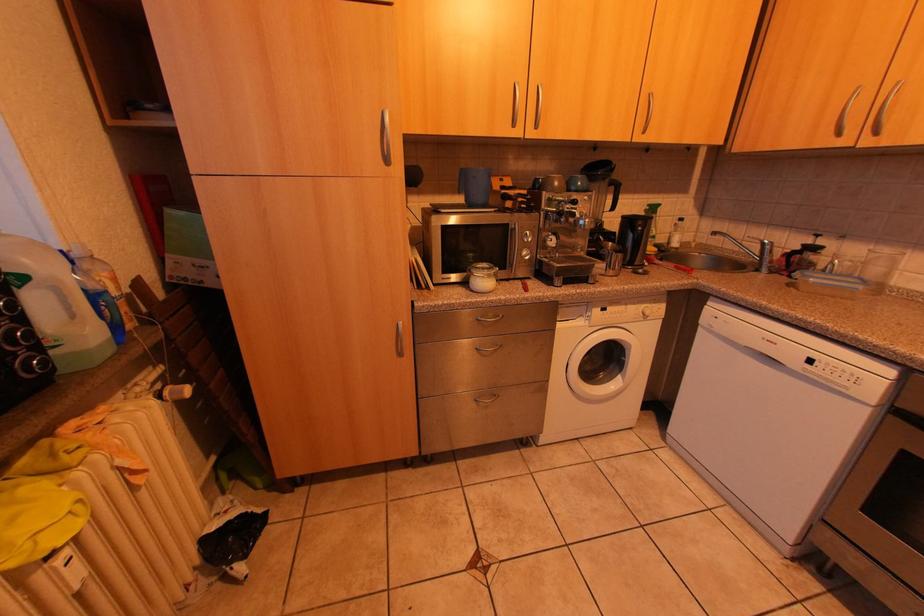
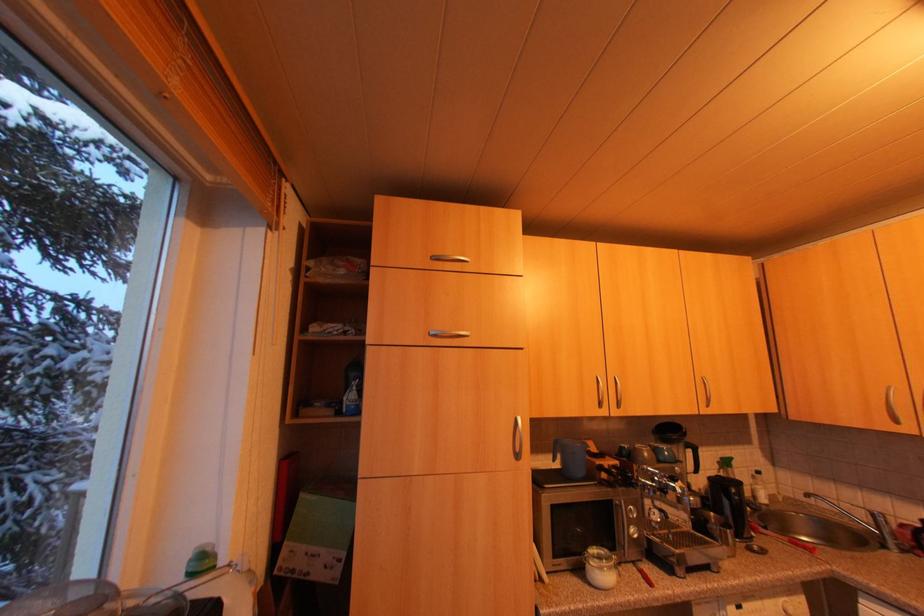
Question: How did the camera likely rotate?

Choices:
 (A) Left
 (B) Right
 (C) Up
 (D) Down

Answer: (C)